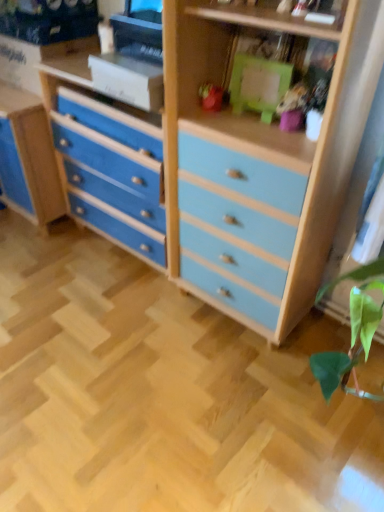
Where is `matte pink toy at upper center, the 2th toy positioned from the left`? The height and width of the screenshot is (512, 384). matte pink toy at upper center, the 2th toy positioned from the left is located at coordinates (293, 108).

This screenshot has width=384, height=512. What do you see at coordinates (293, 108) in the screenshot? I see `matte pink toy at upper center, which appears as the first toy when viewed from the right` at bounding box center [293, 108].

How much space does matte plastic toy at center, placed as the 1th toy when sorted from left to right, occupy horizontally?

The width of matte plastic toy at center, placed as the 1th toy when sorted from left to right, is 2.62 inches.

Where is `matte plastic toy at center, placed as the 1th toy when sorted from left to right`? matte plastic toy at center, placed as the 1th toy when sorted from left to right is located at coordinates pyautogui.click(x=211, y=97).

Image resolution: width=384 pixels, height=512 pixels. Describe the element at coordinates (211, 97) in the screenshot. I see `matte plastic toy at center, the second toy positioned from the right` at that location.

In order to face matte plastic toy at center, placed as the 1th toy when sorted from left to right, should I rotate leftwards or rightwards?

Result: A 2.324 degree turn to the right will do.

Find the location of a particular element. This screenshot has height=512, width=384. matte pink toy at upper center, the 2th toy positioned from the left is located at coordinates (293, 108).

Between matte plastic toy at center, the second toy positioned from the right, and matte pink toy at upper center, which appears as the first toy when viewed from the right, which one appears on the right side from the viewer's perspective?

matte pink toy at upper center, which appears as the first toy when viewed from the right, is more to the right.

Which object is closer to the camera taking this photo, matte plastic toy at center, the second toy positioned from the right, or matte pink toy at upper center, which appears as the first toy when viewed from the right?

matte pink toy at upper center, which appears as the first toy when viewed from the right, is in front.

Is point (218, 92) less distant than point (293, 115)?

No, it is not.

From the image's perspective, which one is positioned higher, matte plastic toy at center, placed as the 1th toy when sorted from left to right, or matte pink toy at upper center, which appears as the first toy when viewed from the right?

matte plastic toy at center, placed as the 1th toy when sorted from left to right, is shown above in the image.

In the scene shown: From a real-world perspective, who is located higher, matte plastic toy at center, the second toy positioned from the right, or matte pink toy at upper center, which appears as the first toy when viewed from the right?

From a 3D spatial view, matte pink toy at upper center, which appears as the first toy when viewed from the right, is above.

Looking at their sizes, would you say matte plastic toy at center, placed as the 1th toy when sorted from left to right, is wider or thinner than matte pink toy at upper center, the 2th toy positioned from the left?

Considering their sizes, matte plastic toy at center, placed as the 1th toy when sorted from left to right, looks slimmer than matte pink toy at upper center, the 2th toy positioned from the left.

Consider the image. Considering the relative sizes of matte plastic toy at center, the second toy positioned from the right, and matte pink toy at upper center, which appears as the first toy when viewed from the right, in the image provided, is matte plastic toy at center, the second toy positioned from the right, shorter than matte pink toy at upper center, which appears as the first toy when viewed from the right,?

Yes.

Is matte plastic toy at center, placed as the 1th toy when sorted from left to right, bigger or smaller than matte pink toy at upper center, the 2th toy positioned from the left?

Clearly, matte plastic toy at center, placed as the 1th toy when sorted from left to right, is smaller in size than matte pink toy at upper center, the 2th toy positioned from the left.

Is matte plastic toy at center, the second toy positioned from the right, positioned beyond the bounds of matte pink toy at upper center, the 2th toy positioned from the left?

Absolutely, matte plastic toy at center, the second toy positioned from the right, is external to matte pink toy at upper center, the 2th toy positioned from the left.

Are matte plastic toy at center, the second toy positioned from the right, and matte pink toy at upper center, the 2th toy positioned from the left, beside each other?

matte plastic toy at center, the second toy positioned from the right, and matte pink toy at upper center, the 2th toy positioned from the left, are clearly separated.

Is matte plastic toy at center, placed as the 1th toy when sorted from left to right, aimed at matte pink toy at upper center, the 2th toy positioned from the left?

No.

Looking at this image, what's the angular difference between matte plastic toy at center, placed as the 1th toy when sorted from left to right, and matte pink toy at upper center, which appears as the first toy when viewed from the right,'s facing directions?

The facing directions of matte plastic toy at center, placed as the 1th toy when sorted from left to right, and matte pink toy at upper center, which appears as the first toy when viewed from the right, are 0.002 degrees apart.

Locate an element on the screen. toy above the matte pink toy at upper center, which appears as the first toy when viewed from the right (from the image's perspective) is located at coordinates (211, 97).

Can you confirm if matte pink toy at upper center, the 2th toy positioned from the left, is positioned to the right of matte plastic toy at center, placed as the 1th toy when sorted from left to right?

Yes, matte pink toy at upper center, the 2th toy positioned from the left, is to the right of matte plastic toy at center, placed as the 1th toy when sorted from left to right.

Based on the photo, between matte pink toy at upper center, the 2th toy positioned from the left, and matte plastic toy at center, the second toy positioned from the right, which one is positioned in front?

matte pink toy at upper center, the 2th toy positioned from the left, is more forward.

Considering the points (300, 124) and (222, 88), which point is behind, point (300, 124) or point (222, 88)?

The point (222, 88) is behind.

From the image's perspective, is matte pink toy at upper center, the 2th toy positioned from the left, positioned above or below matte plastic toy at center, the second toy positioned from the right?

Based on their image positions, matte pink toy at upper center, the 2th toy positioned from the left, is located beneath matte plastic toy at center, the second toy positioned from the right.

From a real-world perspective, who is located higher, matte pink toy at upper center, which appears as the first toy when viewed from the right, or matte plastic toy at center, placed as the 1th toy when sorted from left to right?

matte pink toy at upper center, which appears as the first toy when viewed from the right, from a real-world perspective.

Is matte pink toy at upper center, the 2th toy positioned from the left, thinner than matte plastic toy at center, the second toy positioned from the right?

In fact, matte pink toy at upper center, the 2th toy positioned from the left, might be wider than matte plastic toy at center, the second toy positioned from the right.

Does matte pink toy at upper center, the 2th toy positioned from the left, have a greater height compared to matte plastic toy at center, the second toy positioned from the right?

Yes, matte pink toy at upper center, the 2th toy positioned from the left, is taller than matte plastic toy at center, the second toy positioned from the right.

Considering the relative sizes of matte pink toy at upper center, which appears as the first toy when viewed from the right, and matte plastic toy at center, placed as the 1th toy when sorted from left to right, in the image provided, is matte pink toy at upper center, which appears as the first toy when viewed from the right, bigger than matte plastic toy at center, placed as the 1th toy when sorted from left to right,?

Yes, matte pink toy at upper center, which appears as the first toy when viewed from the right, is bigger than matte plastic toy at center, placed as the 1th toy when sorted from left to right.

Is matte pink toy at upper center, the 2th toy positioned from the left, not inside matte plastic toy at center, the second toy positioned from the right?

Indeed, matte pink toy at upper center, the 2th toy positioned from the left, is completely outside matte plastic toy at center, the second toy positioned from the right.

Is the surface of matte pink toy at upper center, which appears as the first toy when viewed from the right, in direct contact with matte plastic toy at center, the second toy positioned from the right?

No, matte pink toy at upper center, which appears as the first toy when viewed from the right, is not next to matte plastic toy at center, the second toy positioned from the right.

Is matte pink toy at upper center, which appears as the first toy when viewed from the right, facing towards matte plastic toy at center, placed as the 1th toy when sorted from left to right?

No.

How different are the orientations of matte pink toy at upper center, which appears as the first toy when viewed from the right, and matte plastic toy at center, the second toy positioned from the right, in degrees?

There is a 0.002-degree angle between the facing directions of matte pink toy at upper center, which appears as the first toy when viewed from the right, and matte plastic toy at center, the second toy positioned from the right.

How distant is matte pink toy at upper center, the 2th toy positioned from the left, from matte plastic toy at center, the second toy positioned from the right?

The distance of matte pink toy at upper center, the 2th toy positioned from the left, from matte plastic toy at center, the second toy positioned from the right, is 10.78 inches.

The height and width of the screenshot is (512, 384). I want to click on toy above the matte plastic toy at center, placed as the 1th toy when sorted from left to right (from a real-world perspective), so coord(293,108).

The height and width of the screenshot is (512, 384). Identify the location of toy that appears below the matte pink toy at upper center, the 2th toy positioned from the left (from a real-world perspective). (211, 97).

In order to click on toy below the matte plastic toy at center, the second toy positioned from the right (from the image's perspective) in this screenshot , I will do 293,108.